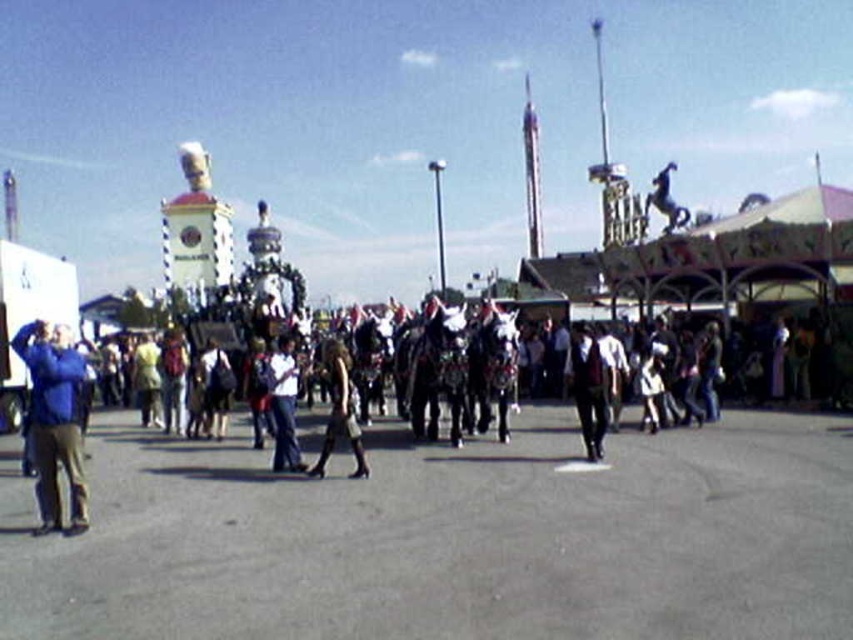
You are standing at the edge of the fairground and see the blue fabric jacket at left and the black leather boots at center. Which one is closer to you?

The blue fabric jacket at left is closer to you because it is in front of the black leather boots at center.

You are a photographer at the fairground. You want to take a photo of the white cotton shirt at center and the black leather boots at center. From the perspective of someone facing the scene, which object is positioned to the left?

The white cotton shirt at center is to the left of the black leather boots at center.